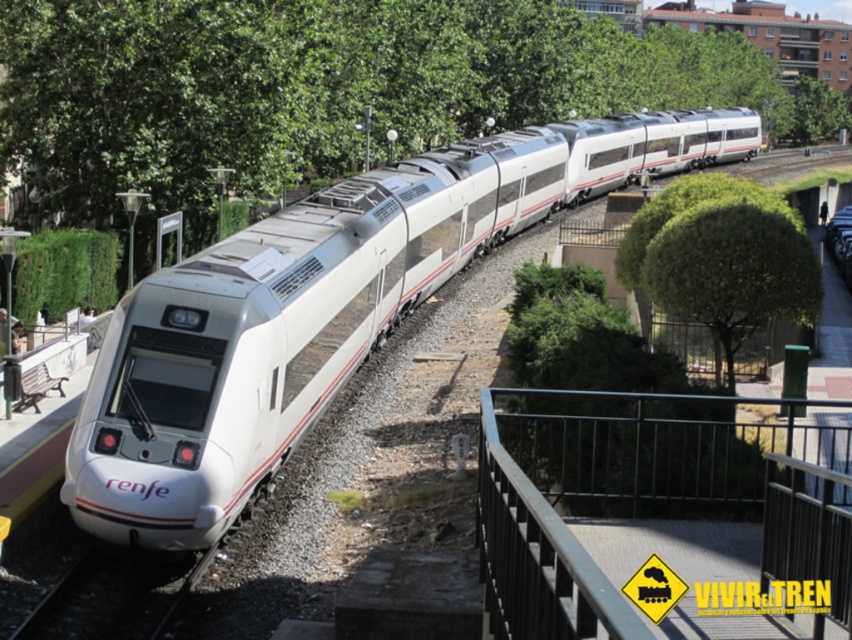
You are standing on the pedestrian walkway next to the railway tracks. You notice a point marked at coordinates (281,332). What object is located at that point?

The point at coordinates (281,332) indicates the white glossy bullet train at center.

You are standing at the pedestrian walkway with railings near the tracks. You see the white glossy bullet train at center. Based on its position coordinates, which direction is the train facing relative to you?

The white glossy bullet train at center is facing towards the direction of the pedestrian walkway with railings since its coordinates are at point 0.519 on the x and 0.331 on the y axis.

You are a photographer standing at the scene of the Renfe AVE train. You notice the black metal train track at lower left and the green leafy tree at upper center in your viewfinder. Which object appears taller in the photo?

The green leafy tree at upper center appears taller than the black metal train track at lower left in the photo.